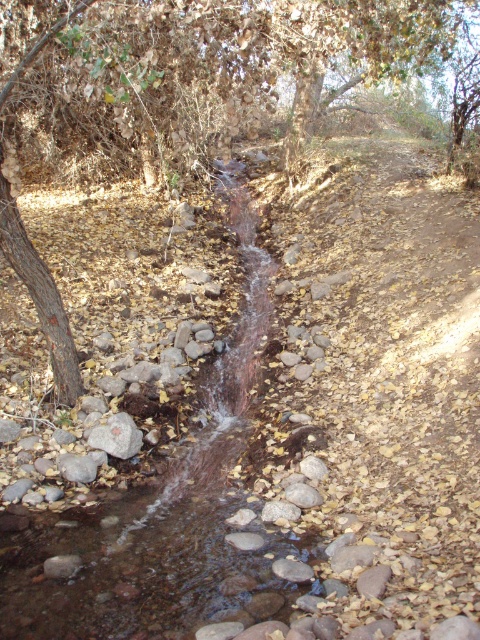
Is point (48, 278) behind point (111, 445)?

Yes.

Can you confirm if brown textured tree at upper left is shorter than gray smooth rock at center-left?

In fact, brown textured tree at upper left may be taller than gray smooth rock at center-left.

Does point (375, 52) come in front of point (129, 449)?

No.

This screenshot has height=640, width=480. What are the coordinates of `brown textured tree at upper left` in the screenshot? It's located at (207, 60).

Which is more to the right, clear water stream at center or brown textured tree at upper left?

Positioned to the right is brown textured tree at upper left.

Which is in front, point (289, 540) or point (245, 116)?

Point (289, 540) is more forward.

Which is in front, point (280, 579) or point (229, 8)?

Point (280, 579) is in front.

At what (x,y) coordinates should I click in order to perform the action: click on clear water stream at center. Please return your answer as a coordinate pair (x, y). This screenshot has width=480, height=640. Looking at the image, I should click on (164, 417).

Can you confirm if clear water stream at center is positioned above gray smooth rock at center-left?

Correct, clear water stream at center is located above gray smooth rock at center-left.

What are the coordinates of `clear water stream at center` in the screenshot? It's located at (164, 417).

Describe the element at coordinates (164, 417) in the screenshot. I see `clear water stream at center` at that location.

Locate an element on the screen. Image resolution: width=480 pixels, height=640 pixels. clear water stream at center is located at coordinates (164, 417).